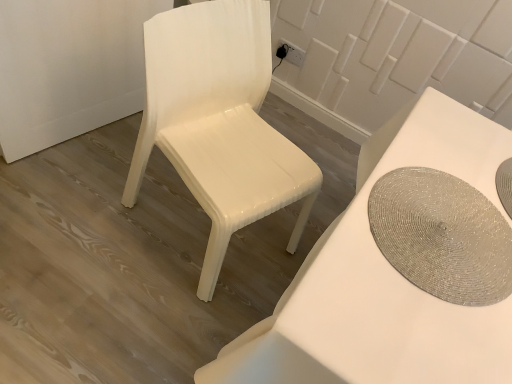
Question: Is white glossy chair at left to the left or to the right of white glossy table at center in the image?

Choices:
 (A) left
 (B) right

Answer: (A)

Question: Is white glossy chair at left taller or shorter than white glossy table at center?

Choices:
 (A) tall
 (B) short

Answer: (A)

Question: Which object is positioned farthest from the shiny silver placemat at right?

Choices:
 (A) white glossy table at center
 (B) white glossy chair at left

Answer: (B)

Question: Considering the real-world distances, which object is farthest from the white glossy chair at left?

Choices:
 (A) shiny silver placemat at right
 (B) white glossy table at center

Answer: (A)